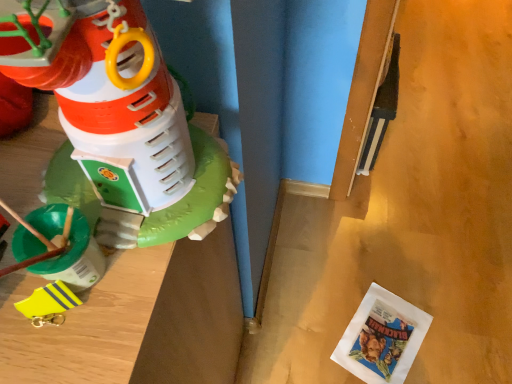
What do you see at coordinates (382, 337) in the screenshot? I see `white paper comic book at lower right` at bounding box center [382, 337].

You are a GUI agent. You are given a task and a screenshot of the screen. Output one action in this format:
    pyautogui.click(x=<x>, y=<y>)
    Task: Click on the yellow rubber boot at left, positioned as the second toy in top-to-bottom order
    The image size is (512, 384).
    Given the screenshot: What is the action you would take?
    pyautogui.click(x=48, y=304)

The width and height of the screenshot is (512, 384). I want to click on white paper comic book at lower right, so click(x=382, y=337).

Is yellow rubber boot at left, marked as the 1th toy in a bottom-to-top arrangement, in front of white paper comic book at lower right?

Yes, yellow rubber boot at left, marked as the 1th toy in a bottom-to-top arrangement, is in front of white paper comic book at lower right.

Based on their sizes in the image, would you say yellow rubber boot at left, positioned as the second toy in top-to-bottom order, is bigger or smaller than white paper comic book at lower right?

In the image, yellow rubber boot at left, positioned as the second toy in top-to-bottom order, appears to be smaller than white paper comic book at lower right.

Between yellow rubber boot at left, marked as the 1th toy in a bottom-to-top arrangement, and white paper comic book at lower right, which one has larger width?

Wider between the two is white paper comic book at lower right.

From the picture: Is yellow rubber boot at left, marked as the 1th toy in a bottom-to-top arrangement, a part of matte plastic toy at left, the 2th toy viewed from the back?

No, yellow rubber boot at left, marked as the 1th toy in a bottom-to-top arrangement, is located outside of matte plastic toy at left, the 2th toy viewed from the back.

Where is `toy on the left of matte plastic toy at left, placed as the 2th toy when sorted from bottom to top`? toy on the left of matte plastic toy at left, placed as the 2th toy when sorted from bottom to top is located at coordinates (48, 304).

Which is closer to the camera, (x=155, y=240) or (x=62, y=305)?

The point (x=62, y=305) is in front.

From the white paper comic book at lower right, count the 1st toy to the left and point to it. Please provide its 2D coordinates.

[(133, 131)]

From a real-world perspective, between white paper comic book at lower right and matte plastic toy at left, which appears as the first toy when viewed from the front, who is vertically lower?

From a 3D spatial view, white paper comic book at lower right is below.

Can you confirm if white paper comic book at lower right is taller than matte plastic toy at left, which appears as the first toy when viewed from the front?

Incorrect, the height of white paper comic book at lower right is not larger of that of matte plastic toy at left, which appears as the first toy when viewed from the front.

From a real-world perspective, is white paper comic book at lower right under yellow rubber boot at left, marked as the 1th toy in a bottom-to-top arrangement?

Yes, from a real-world perspective, white paper comic book at lower right is under yellow rubber boot at left, marked as the 1th toy in a bottom-to-top arrangement.

Are white paper comic book at lower right and yellow rubber boot at left, which appears as the 1th toy when viewed from the back, far apart?

Absolutely, white paper comic book at lower right is distant from yellow rubber boot at left, which appears as the 1th toy when viewed from the back.

Can you confirm if white paper comic book at lower right is positioned to the left of yellow rubber boot at left, the 2th toy when ordered from front to back?

No.

Locate an element on the screen. comic book beneath the yellow rubber boot at left, positioned as the second toy in top-to-bottom order (from a real-world perspective) is located at coordinates (382, 337).

Consider the image. Which of these two, yellow rubber boot at left, positioned as the second toy in top-to-bottom order, or matte plastic toy at left, the 2th toy viewed from the back, stands shorter?

yellow rubber boot at left, positioned as the second toy in top-to-bottom order, is shorter.

Considering their positions, is yellow rubber boot at left, which appears as the 1th toy when viewed from the back, located in front of or behind matte plastic toy at left, placed as the 2th toy when sorted from bottom to top?

Clearly, yellow rubber boot at left, which appears as the 1th toy when viewed from the back, is behind matte plastic toy at left, placed as the 2th toy when sorted from bottom to top.

Which is more to the left, yellow rubber boot at left, positioned as the second toy in top-to-bottom order, or matte plastic toy at left, the 2th toy viewed from the back?

From the viewer's perspective, yellow rubber boot at left, positioned as the second toy in top-to-bottom order, appears more on the left side.

Are yellow rubber boot at left, which appears as the 1th toy when viewed from the back, and matte plastic toy at left, which appears as the first toy when viewed from the front, far apart?

No.

Is matte plastic toy at left, the 2th toy viewed from the back, thinner than white paper comic book at lower right?

Yes, matte plastic toy at left, the 2th toy viewed from the back, is thinner than white paper comic book at lower right.

Based on the photo, which of these two, matte plastic toy at left, which appears as the first toy when viewed from the front, or white paper comic book at lower right, is smaller?

Smaller between the two is white paper comic book at lower right.

From the image's perspective, is matte plastic toy at left, which appears as the first toy when viewed from the front, on white paper comic book at lower right?

Yes, from the image's perspective, matte plastic toy at left, which appears as the first toy when viewed from the front, is over white paper comic book at lower right.

From a real-world perspective, count 1st toys upward from the white paper comic book at lower right and point to it. Please provide its 2D coordinates.

[(48, 304)]

This screenshot has height=384, width=512. I want to click on toy that appears in front of the yellow rubber boot at left, which appears as the 1th toy when viewed from the back, so click(x=133, y=131).

Based on their spatial positions, is yellow rubber boot at left, which appears as the 1th toy when viewed from the back, or white paper comic book at lower right closer to matte plastic toy at left, the 2th toy viewed from the back?

The object closer to matte plastic toy at left, the 2th toy viewed from the back, is yellow rubber boot at left, which appears as the 1th toy when viewed from the back.

Looking at the image, which one is located further to yellow rubber boot at left, the 2th toy when ordered from front to back, white paper comic book at lower right or matte plastic toy at left, marked as the first toy in a top-to-bottom arrangement?

white paper comic book at lower right.

Considering their positions, is matte plastic toy at left, marked as the first toy in a top-to-bottom arrangement, positioned further to yellow rubber boot at left, the 2th toy when ordered from front to back, than white paper comic book at lower right?

Based on the image, white paper comic book at lower right appears to be further to yellow rubber boot at left, the 2th toy when ordered from front to back.

Looking at this image, which object lies further to the anchor point matte plastic toy at left, the 2th toy viewed from the back, white paper comic book at lower right or yellow rubber boot at left, positioned as the second toy in top-to-bottom order?

white paper comic book at lower right is positioned further to the anchor matte plastic toy at left, the 2th toy viewed from the back.

When comparing their distances from white paper comic book at lower right, does matte plastic toy at left, the 2th toy viewed from the back, or yellow rubber boot at left, positioned as the second toy in top-to-bottom order, seem closer?

Among the two, matte plastic toy at left, the 2th toy viewed from the back, is located nearer to white paper comic book at lower right.

Estimate the real-world distances between objects in this image. Which object is closer to white paper comic book at lower right, yellow rubber boot at left, which appears as the 1th toy when viewed from the back, or matte plastic toy at left, placed as the 2th toy when sorted from bottom to top?

matte plastic toy at left, placed as the 2th toy when sorted from bottom to top, is positioned closer to the anchor white paper comic book at lower right.

Where is `toy located between matte plastic toy at left, the 2th toy viewed from the back, and white paper comic book at lower right in the depth direction`? The width and height of the screenshot is (512, 384). toy located between matte plastic toy at left, the 2th toy viewed from the back, and white paper comic book at lower right in the depth direction is located at coordinates (48, 304).